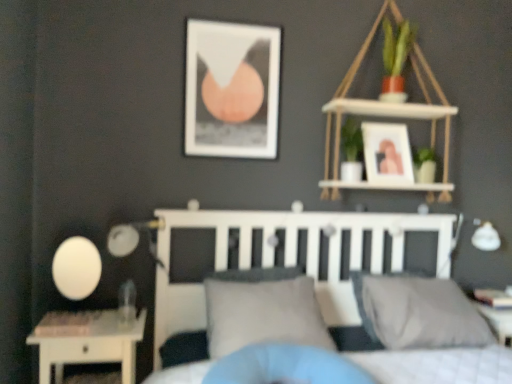
Question: Is matte black picture frame at upper center, which is counted as the 1th picture frame, starting from the left, smaller than matte white picture frame at upper right, the second picture frame in the left-to-right sequence?

Choices:
 (A) no
 (B) yes

Answer: (B)

Question: Is matte black picture frame at upper center, the second picture frame in the right-to-left sequence, wider than matte white picture frame at upper right, the 1th picture frame in the right-to-left sequence?

Choices:
 (A) yes
 (B) no

Answer: (B)

Question: Considering the relative positions of matte black picture frame at upper center, which is counted as the 1th picture frame, starting from the left, and matte white picture frame at upper right, the 1th picture frame in the right-to-left sequence, in the image provided, is matte black picture frame at upper center, which is counted as the 1th picture frame, starting from the left, to the left of matte white picture frame at upper right, the 1th picture frame in the right-to-left sequence, from the viewer's perspective?

Choices:
 (A) yes
 (B) no

Answer: (A)

Question: Are matte black picture frame at upper center, which is counted as the 1th picture frame, starting from the left, and matte white picture frame at upper right, the second picture frame in the left-to-right sequence, far apart?

Choices:
 (A) no
 (B) yes

Answer: (A)

Question: Is matte black picture frame at upper center, which is counted as the 1th picture frame, starting from the left, next to matte white picture frame at upper right, the 1th picture frame in the right-to-left sequence, and touching it?

Choices:
 (A) yes
 (B) no

Answer: (B)

Question: Does matte black picture frame at upper center, which is counted as the 1th picture frame, starting from the left, contain matte white picture frame at upper right, the 1th picture frame in the right-to-left sequence?

Choices:
 (A) no
 (B) yes

Answer: (A)

Question: From the image's perspective, would you say white matte bed at center is positioned over matte white picture frame at upper right, the 1th picture frame in the right-to-left sequence?

Choices:
 (A) no
 (B) yes

Answer: (A)

Question: Does white matte bed at center have a lesser width compared to matte white picture frame at upper right, the second picture frame in the left-to-right sequence?

Choices:
 (A) no
 (B) yes

Answer: (A)

Question: Can you confirm if white matte bed at center is bigger than matte white picture frame at upper right, the second picture frame in the left-to-right sequence?

Choices:
 (A) yes
 (B) no

Answer: (A)

Question: Is white matte bed at center taller than matte white picture frame at upper right, the 1th picture frame in the right-to-left sequence?

Choices:
 (A) yes
 (B) no

Answer: (A)

Question: Is the position of white matte bed at center less distant than that of matte white picture frame at upper right, the 1th picture frame in the right-to-left sequence?

Choices:
 (A) yes
 (B) no

Answer: (A)

Question: Is matte white picture frame at upper right, the second picture frame in the left-to-right sequence, located within white matte bed at center?

Choices:
 (A) yes
 (B) no

Answer: (B)

Question: Is white wood shelf at upper right not within gray fabric pillow at center, which is the 2th pillow from right to left?

Choices:
 (A) yes
 (B) no

Answer: (A)